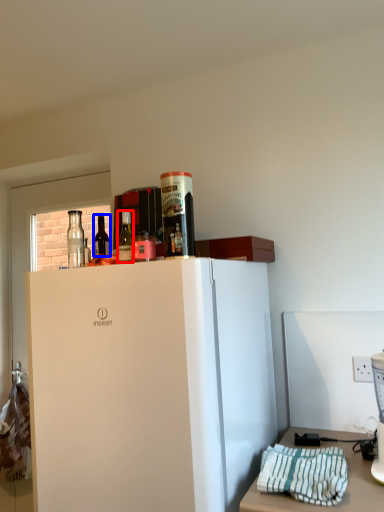
Question: Among these objects, which one is farthest to the camera, bottle (highlighted by a red box) or bottle (highlighted by a blue box)?

Choices:
 (A) bottle
 (B) bottle

Answer: (B)